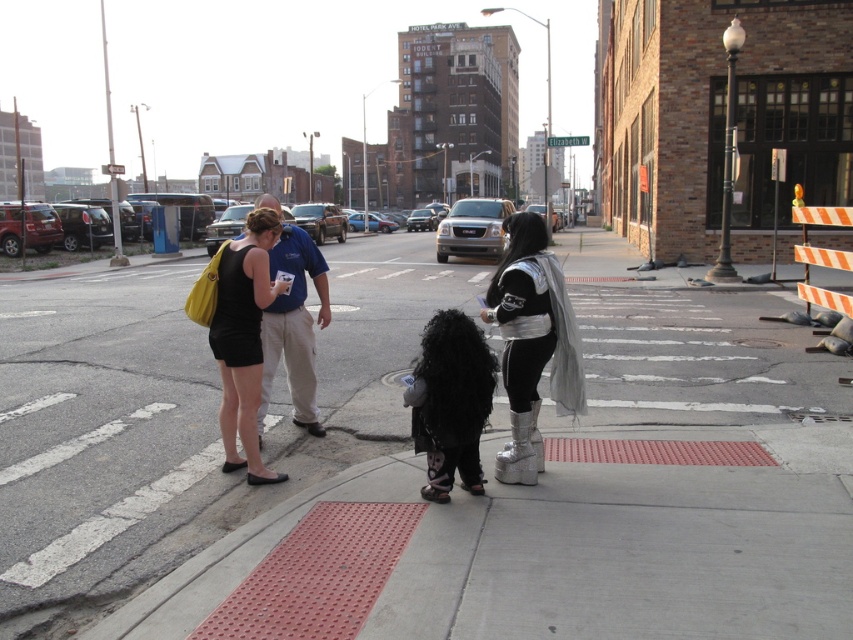
I want to click on smooth concrete sidewalk at center, so click(x=653, y=486).

Does point (146, 483) come farther from viewer compared to point (268, 236)?

No, (146, 483) is closer to viewer.

Who is more forward, (454, 275) or (239, 355)?

Point (239, 355)

Where is `smooth concrete sidewalk at center`? This screenshot has height=640, width=853. smooth concrete sidewalk at center is located at coordinates (653, 486).

Does silver metallic platform boots at center appear on the left side of black matte dress at center?

No, silver metallic platform boots at center is not to the left of black matte dress at center.

Which is in front, point (538, 220) or point (252, 300)?

Point (538, 220) is in front.

Image resolution: width=853 pixels, height=640 pixels. What do you see at coordinates (532, 342) in the screenshot?
I see `silver metallic platform boots at center` at bounding box center [532, 342].

Image resolution: width=853 pixels, height=640 pixels. I want to click on silver metallic platform boots at center, so click(x=532, y=342).

Which is below, black matte dress at center or blue cotton shirt at center?

black matte dress at center is below.

Is black matte dress at center above blue cotton shirt at center?

Actually, black matte dress at center is below blue cotton shirt at center.

This screenshot has height=640, width=853. Find the location of `black matte dress at center`. black matte dress at center is located at coordinates (242, 339).